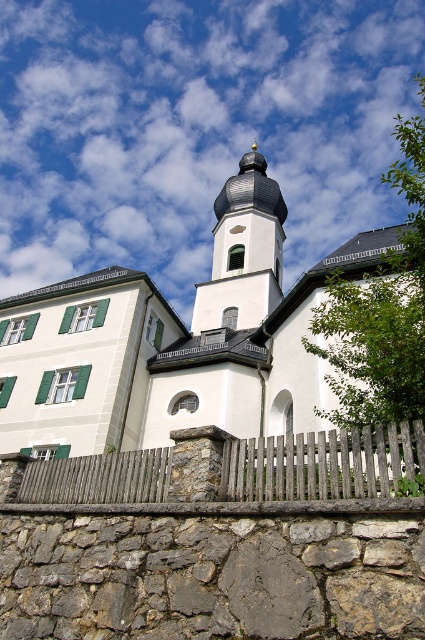
Does white stone church at upper center have a larger size compared to wooden picket fence at lower center?

Correct, white stone church at upper center is larger in size than wooden picket fence at lower center.

Who is more forward, (x=229, y=284) or (x=300, y=440)?

Point (x=300, y=440)

Describe the element at coordinates (190, 371) in the screenshot. I see `white stone church at upper center` at that location.

At what (x,y) coordinates should I click in order to perform the action: click on white stone church at upper center. Please return your answer as a coordinate pair (x, y). Image resolution: width=425 pixels, height=640 pixels. Looking at the image, I should click on (190, 371).

What do you see at coordinates (323, 464) in the screenshot? I see `wooden picket fence at lower center` at bounding box center [323, 464].

Identify the location of wooden picket fence at lower center. Image resolution: width=425 pixels, height=640 pixels. (323, 464).

Based on the photo, does white stone church at upper center have a lesser height compared to white stone tower at center?

No, white stone church at upper center is not shorter than white stone tower at center.

Is white stone church at upper center below white stone tower at center?

Yes.

Is point (181, 358) behind point (226, 275)?

No, it is in front of (226, 275).

The height and width of the screenshot is (640, 425). Find the location of `white stone church at upper center`. white stone church at upper center is located at coordinates (190, 371).